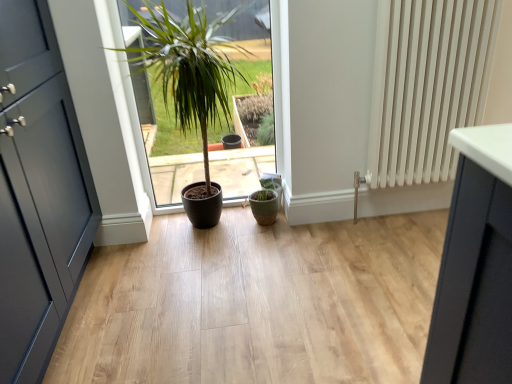
Where is `vacant region below matte brown pot at center (from a real-world perspective)`? This screenshot has height=384, width=512. vacant region below matte brown pot at center (from a real-world perspective) is located at coordinates (208, 231).